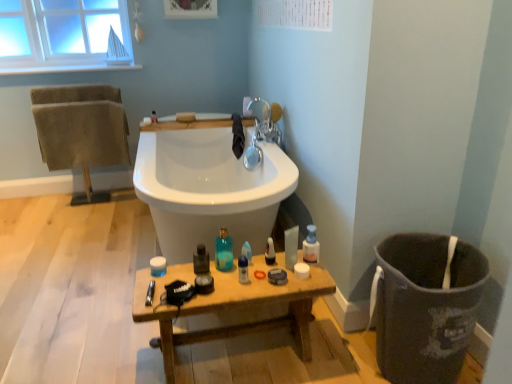
The height and width of the screenshot is (384, 512). Identify the location of vacant space to the left of wooden table at lower center. (112, 336).